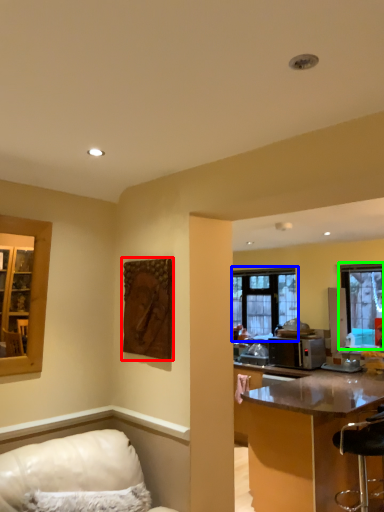
Question: Which object is the closest to the picture frame (highlighted by a red box)? Choose among these: window (highlighted by a blue box) or window (highlighted by a green box).

Choices:
 (A) window
 (B) window

Answer: (B)